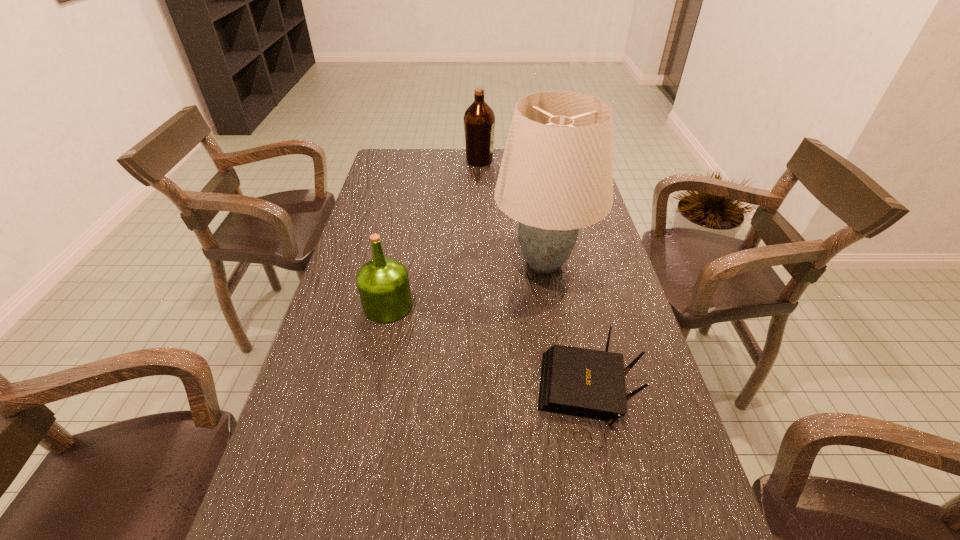
At what (x,y) coordinates should I click in order to perform the action: click on lampshade. Please return your answer as a coordinate pair (x, y). The width and height of the screenshot is (960, 540). Looking at the image, I should click on (556, 176).

Locate an element on the screen. The height and width of the screenshot is (540, 960). the third shortest object is located at coordinates (479, 120).

At what (x,y) coordinates should I click in order to perform the action: click on the farther olive oil. Please return your answer as a coordinate pair (x, y). Looking at the image, I should click on (479, 120).

Find the location of a particular element. The image size is (960, 540). the third tallest object is located at coordinates (383, 284).

The width and height of the screenshot is (960, 540). I want to click on the leftmost object, so click(x=383, y=284).

The height and width of the screenshot is (540, 960). Find the location of `the shortest object`. the shortest object is located at coordinates tap(587, 383).

At what (x,y) coordinates should I click in order to perform the action: click on router. Please return your answer as a coordinate pair (x, y). The image size is (960, 540). Looking at the image, I should click on (587, 383).

The height and width of the screenshot is (540, 960). In order to click on vacant region located on the left of the lampshade in this screenshot , I will do `click(425, 262)`.

You are a GUI agent. You are given a task and a screenshot of the screen. Output one action in this format:
    pyautogui.click(x=<x>, y=<y>)
    Task: Click on the free space located on the label of the farther olive oil
    The image size is (960, 540).
    Given the screenshot: What is the action you would take?
    tap(534, 161)

Where is `free space located on the left of the shorter olive oil`? The image size is (960, 540). free space located on the left of the shorter olive oil is located at coordinates (333, 306).